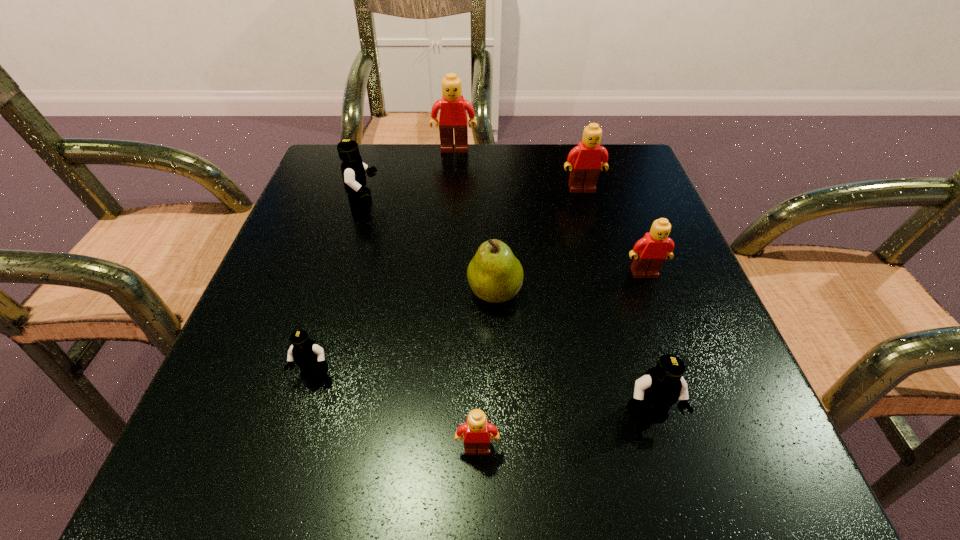
The width and height of the screenshot is (960, 540). I want to click on the tallest Lego, so click(x=452, y=106).

Where is `the farthest Lego`? The width and height of the screenshot is (960, 540). the farthest Lego is located at coordinates 452,106.

Locate an element on the screen. The width and height of the screenshot is (960, 540). the biggest black Lego is located at coordinates (353, 169).

Where is `the third smallest brown Lego`? the third smallest brown Lego is located at coordinates (585, 163).

The height and width of the screenshot is (540, 960). In order to click on pear in this screenshot , I will do `click(495, 275)`.

Where is `the fourth farthest Lego`? the fourth farthest Lego is located at coordinates (650, 252).

Identify the location of the second nearest brown Lego. (650, 252).

Where is `the rightmost black Lego`? Image resolution: width=960 pixels, height=540 pixels. the rightmost black Lego is located at coordinates (660, 387).

The image size is (960, 540). Find the location of `the second nearest Lego`. the second nearest Lego is located at coordinates (660, 387).

At what (x,y) coordinates should I click in order to perform the action: click on the second nearest black Lego. Please return your answer as a coordinate pair (x, y). Image resolution: width=960 pixels, height=540 pixels. Looking at the image, I should click on (309, 357).